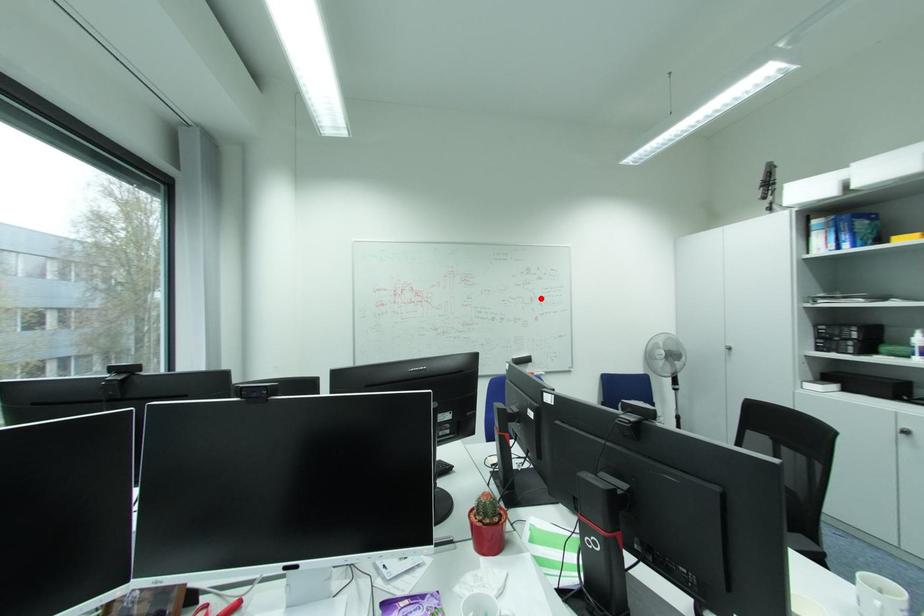
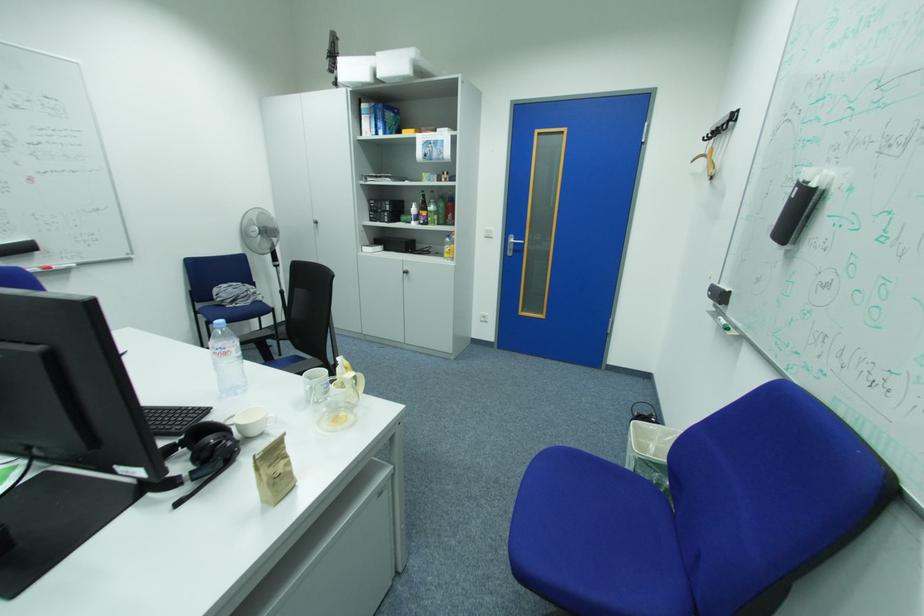
Question: I am providing you with two images of the same scene from different viewpoints. A red point is shown in image1. For the corresponding object point in image2, is it positioned nearer or farther from the camera?

Choices:
 (A) Nearer
 (B) Farther

Answer: (B)